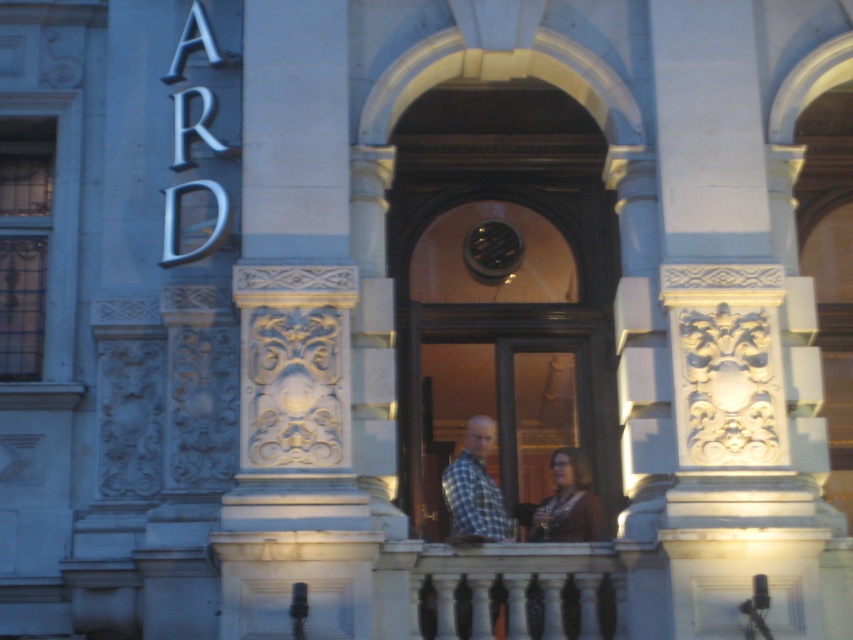
Question: Is white stone carving at center bigger than plaid fabric shirt at center?

Choices:
 (A) no
 (B) yes

Answer: (B)

Question: Which object is the closest to the brown fabric at center?

Choices:
 (A) plaid fabric shirt at center
 (B) matte brown sweater at center
 (C) white stone carving at center

Answer: (B)

Question: Which object is the closest to the brown fabric at center?

Choices:
 (A) white stone carving at center
 (B) matte brown sweater at center
 (C) plaid fabric shirt at center

Answer: (B)

Question: Estimate the real-world distances between objects in this image. Which object is farther from the plaid fabric shirt at center?

Choices:
 (A) white stone carving at center
 (B) matte brown sweater at center
 (C) brown fabric at center

Answer: (A)

Question: Considering the relative positions of plaid fabric shirt at center and matte brown sweater at center in the image provided, where is plaid fabric shirt at center located with respect to matte brown sweater at center?

Choices:
 (A) left
 (B) right

Answer: (A)

Question: Does white stone carving at center come behind plaid fabric shirt at center?

Choices:
 (A) no
 (B) yes

Answer: (A)